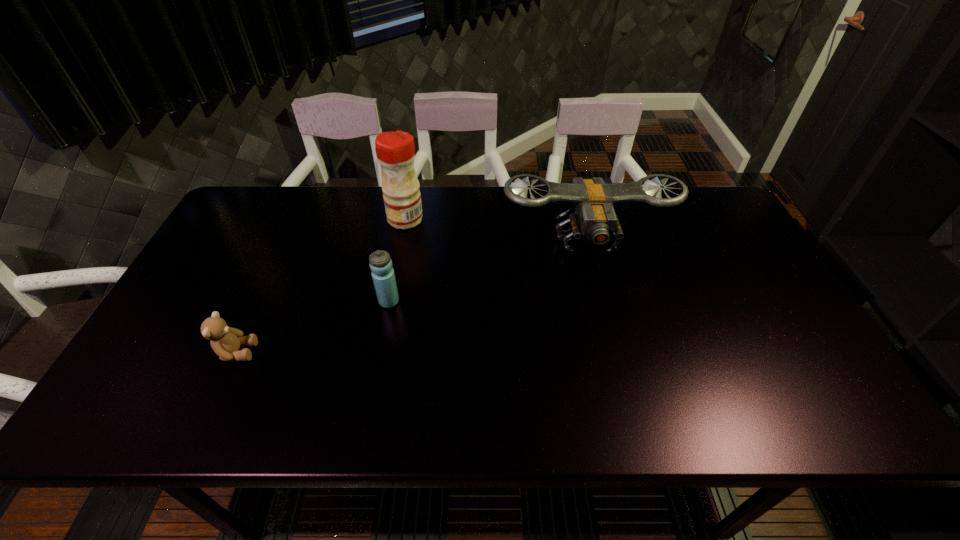
Image resolution: width=960 pixels, height=540 pixels. What are the coordinates of `free location that satisfies the following two spatial constraints: 1. on the front-facing side of the drone; 2. on the front-facing side of the teddy bear` in the screenshot? It's located at [614, 352].

Identify the location of vacant space that satisfies the following two spatial constraints: 1. on the front-facing side of the rightmost object; 2. on the front-facing side of the shortest object. (614, 352).